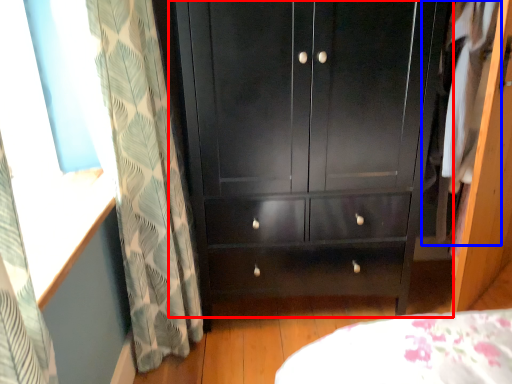
Question: Which of the following is the closest to the observer, cupboard (highlighted by a red box) or clothing (highlighted by a blue box)?

Choices:
 (A) cupboard
 (B) clothing

Answer: (A)